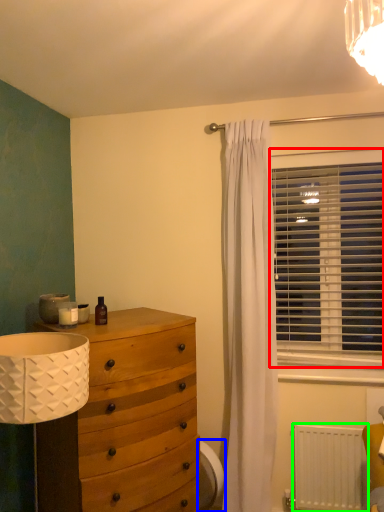
Question: Considering the real-world distances, which object is farthest from window blind (highlighted by a red box)? swivel chair (highlighted by a blue box) or radiator (highlighted by a green box)?

Choices:
 (A) swivel chair
 (B) radiator

Answer: (A)